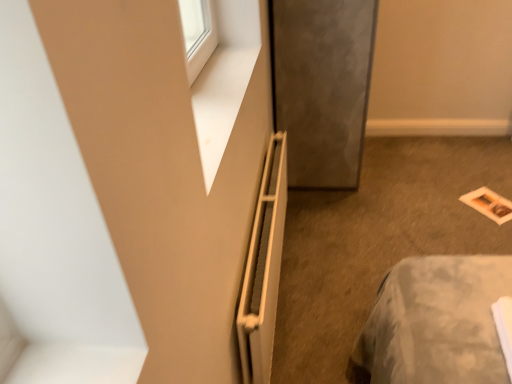
You are a GUI agent. You are given a task and a screenshot of the screen. Output one action in this format:
    pyautogui.click(x=<x>, y=<y>)
    Task: Click on the free space between matte gray screen door at center and matte paper magazine at lower right
    This screenshot has width=512, height=384.
    Given the screenshot: What is the action you would take?
    pyautogui.click(x=400, y=182)